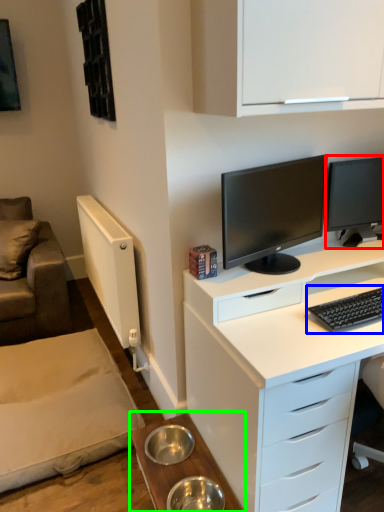
Question: Estimate the real-world distances between objects in this image. Which object is farther from computer monitor (highlighted by a red box), computer keyboard (highlighted by a blue box) or table (highlighted by a green box)?

Choices:
 (A) computer keyboard
 (B) table

Answer: (B)